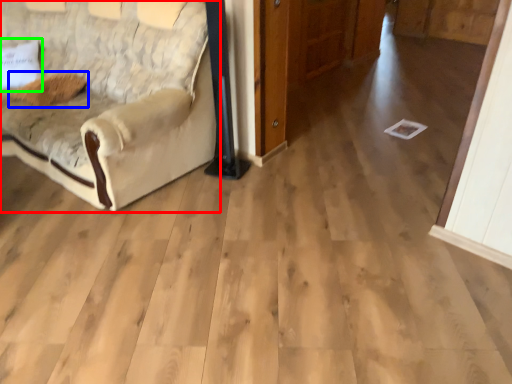
Question: Which is nearer to the studio couch (highlighted by a red box)? pillow (highlighted by a blue box) or pillow (highlighted by a green box).

Choices:
 (A) pillow
 (B) pillow

Answer: (A)